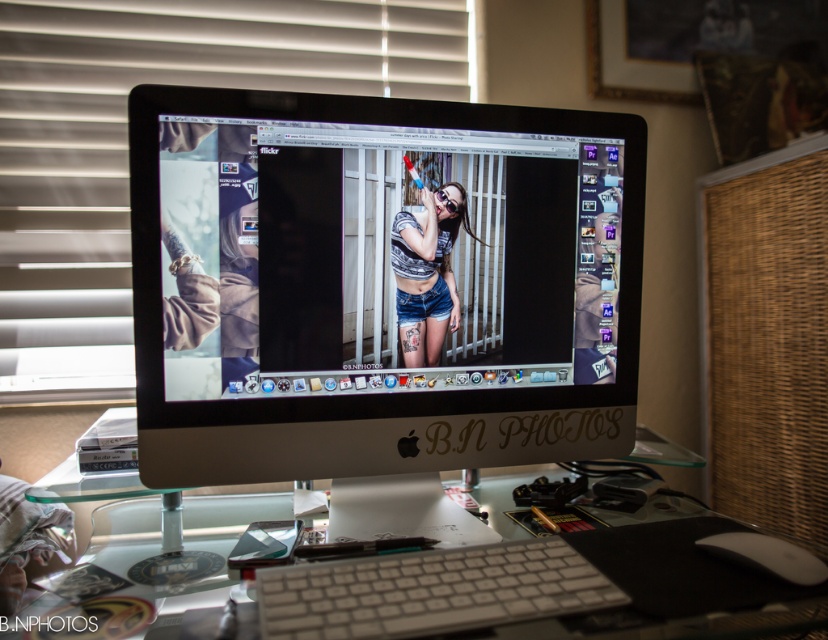
You are standing in front of the computer monitor and want to place a small sticker exactly halfway between point (x=586, y=250) and point (x=75, y=8). Will the sticker be closer to the viewer or farther away compared to the two points?

The sticker placed halfway between point (x=586, y=250) and point (x=75, y=8) will be closer to the viewer than point (x=75, y=8) but farther than point (x=586, y=250) since it is positioned between them.

You are organizing the items on the clear glass computer desk at center and notice the denim shorts at center. Where exactly is the denim shorts located relative to the desk?

The denim shorts at center is positioned above the clear glass computer desk at center since the desk is under it.